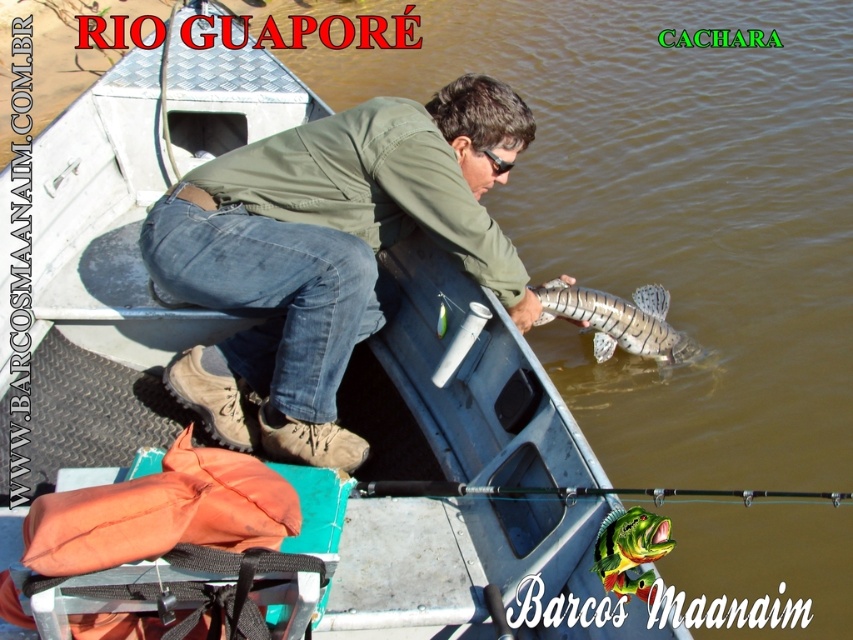
You are a photographer trying to capture a clear photo of the shiny silver fish at center. However, the green matte jacket at center is blocking your view. Can you move the jacket to get a clear shot of the fish?

The green matte jacket at center is positioned over the shiny silver fish at center, so moving the jacket would allow you to see the fish clearly.

You are a photographer trying to capture the black matte fishing pole at center and the green shiny fish at center in a single shot. Which object should you position closer to the left side of the frame to ensure both are visible?

The black matte fishing pole at center is positioned on the right side of the green shiny fish at center, so to ensure both are visible in the frame, you should position the green shiny fish at center closer to the left side.